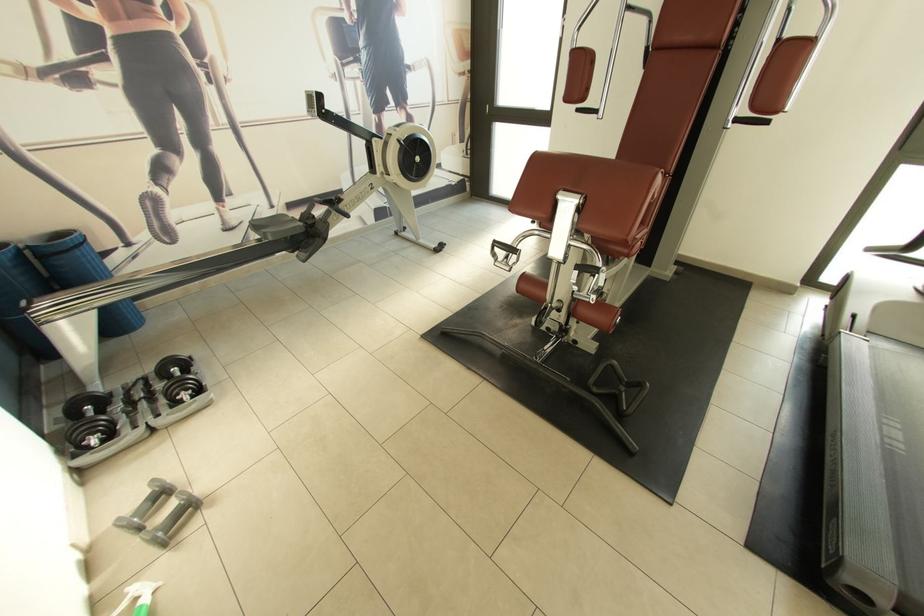
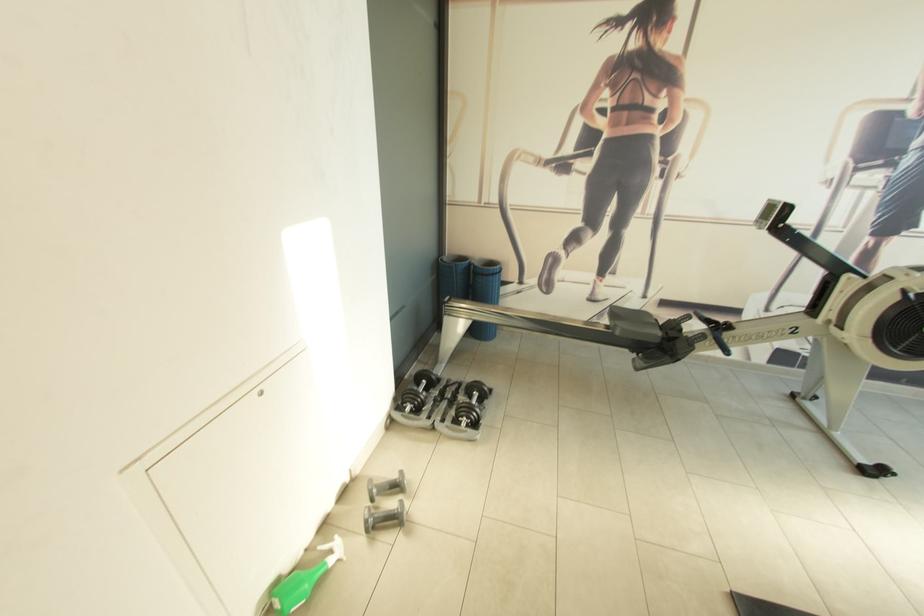
Question: The camera is either moving clockwise (left) or counter-clockwise (right) around the object. The first image is from the beginning of the video and the second image is from the end. Is the camera moving left or right when shooting the video?

Choices:
 (A) Left
 (B) Right

Answer: (B)